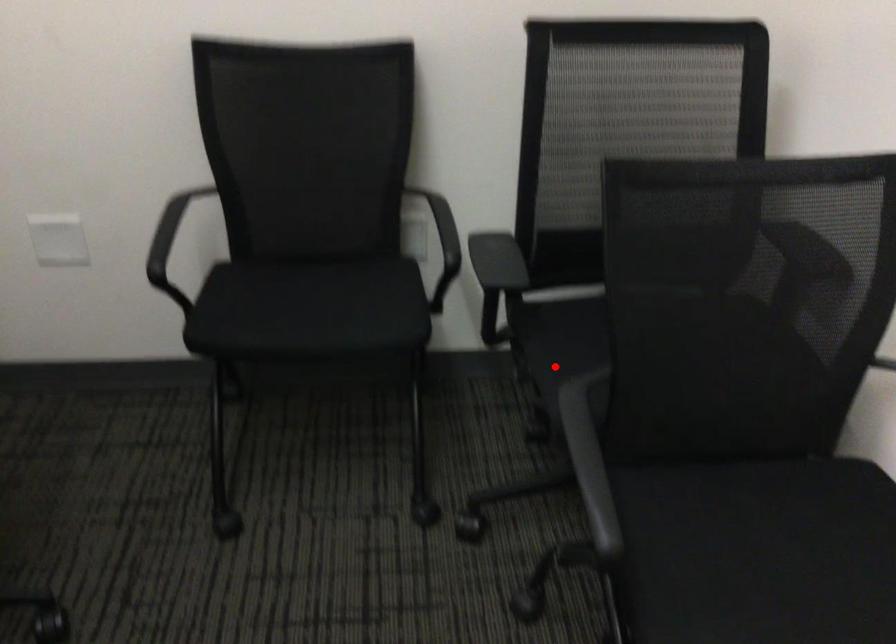
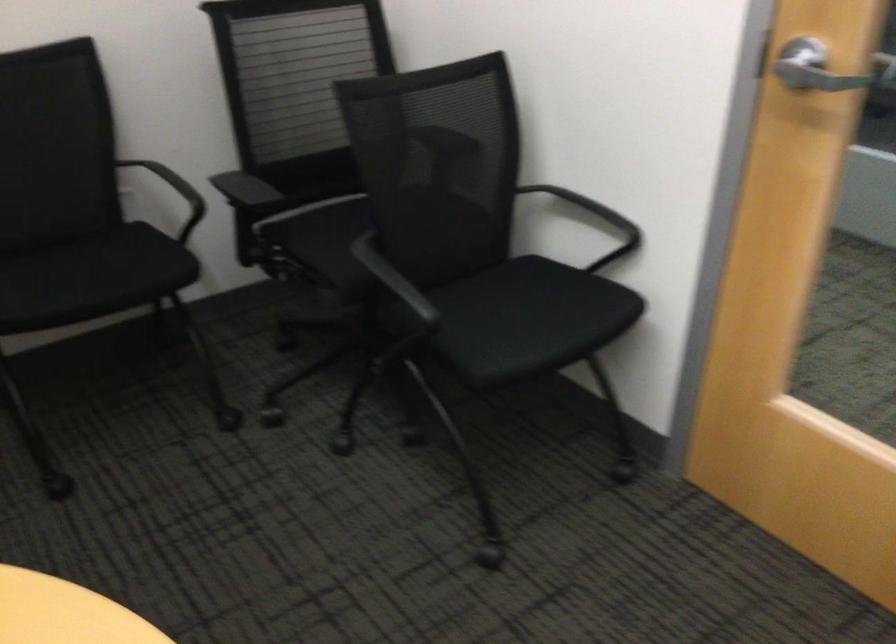
In the second image, find the point that corresponds to the highlighted location in the first image.

(321, 254)